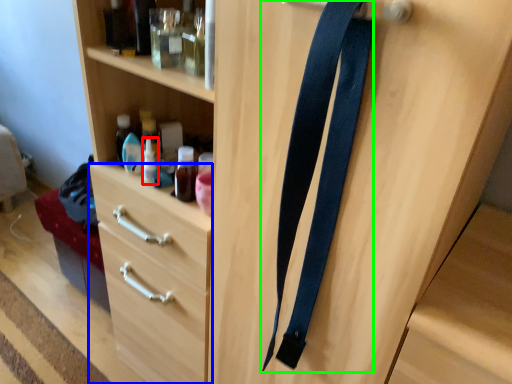
Question: Based on their relative distances, which object is nearer to bottle (highlighted by a red box)? Choose from drawer (highlighted by a blue box) and suspenders (highlighted by a green box).

Choices:
 (A) drawer
 (B) suspenders

Answer: (A)